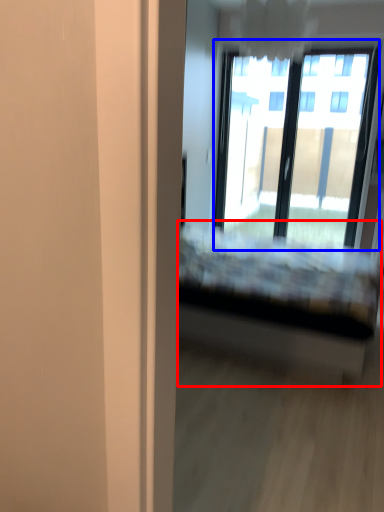
Question: Which object is further to the camera taking this photo, bed (highlighted by a red box) or window (highlighted by a blue box)?

Choices:
 (A) bed
 (B) window

Answer: (B)